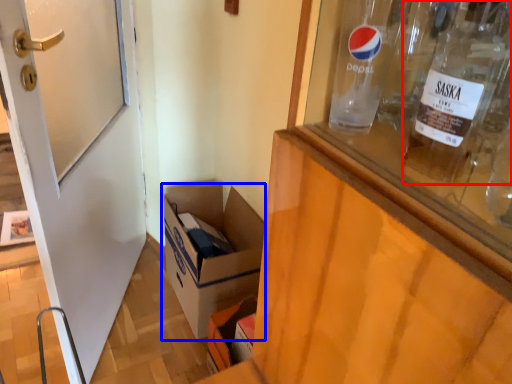
Question: Which object appears closest to the camera in this image, bottle (highlighted by a red box) or box (highlighted by a blue box)?

Choices:
 (A) bottle
 (B) box

Answer: (A)